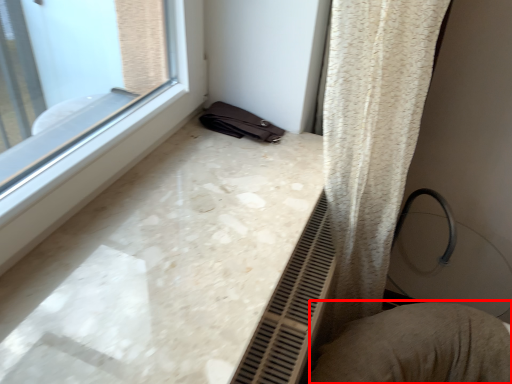
Question: From the image's perspective, considering the relative positions of swivel chair (annotated by the red box) and counter top in the image provided, where is swivel chair (annotated by the red box) located with respect to the staircase?

Choices:
 (A) above
 (B) below

Answer: (B)